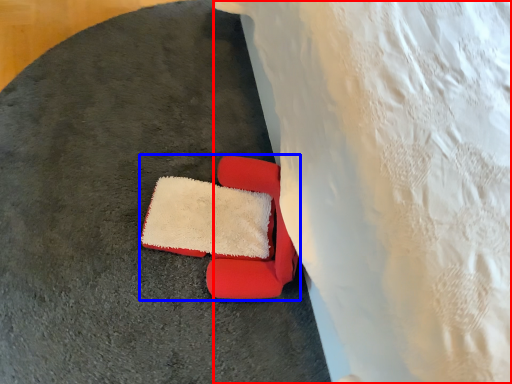
Question: Which point is further to the camera, sheet (highlighted by a red box) or chair (highlighted by a blue box)?

Choices:
 (A) sheet
 (B) chair

Answer: (B)